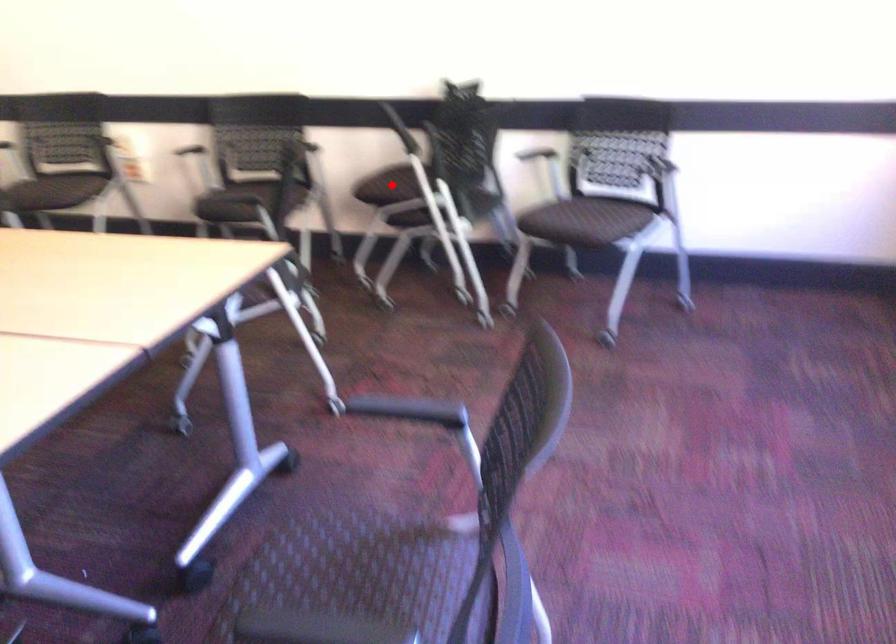
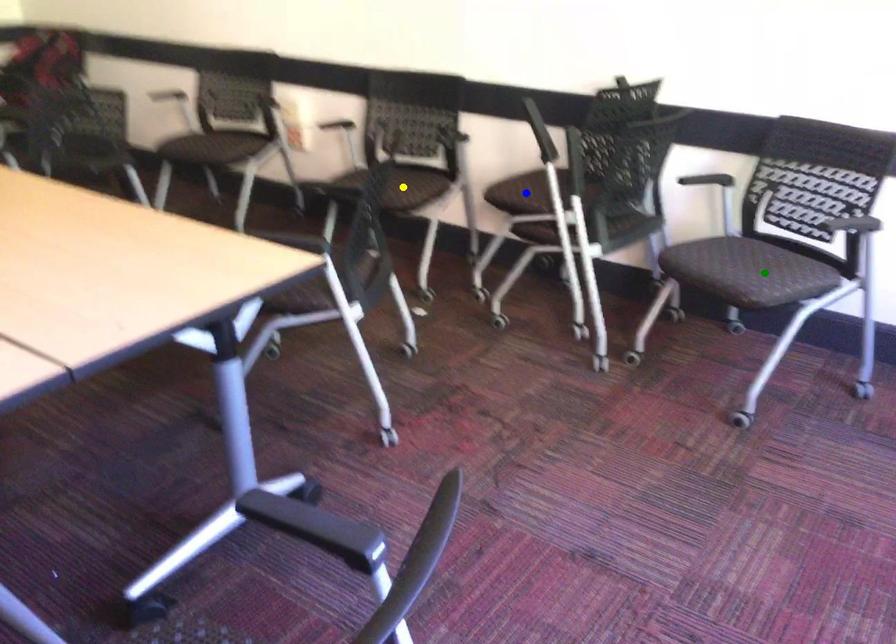
Question: I am providing you with two images of the same scene from different viewpoints. A red point is marked on the first image. You are given multiple points on the second image. Which spot in image 2 lines up with the point in image 1?

Choices:
 (A) blue point
 (B) green point
 (C) yellow point

Answer: (A)